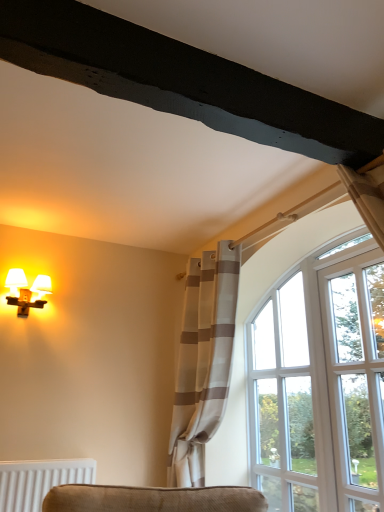
What is the approximate height of matte white sconce at left?

matte white sconce at left is 11.63 inches tall.

Identify the location of clear glass door at right. tap(356, 376).

From the image's perspective, is clear glass door at right over white striped curtain at right?

Yes, from the image's perspective, clear glass door at right is above white striped curtain at right.

Which of these two, clear glass door at right or white striped curtain at right, is bigger?

white striped curtain at right.

Where is `screen door to the right of white striped curtain at right`? The height and width of the screenshot is (512, 384). screen door to the right of white striped curtain at right is located at coordinates (x=356, y=376).

Is the surface of matte white sconce at left in direct contact with clear glass door at right?

They are not placed beside each other.

From a real-world perspective, between matte white sconce at left and clear glass door at right, who is vertically higher?

matte white sconce at left, from a real-world perspective.

Is matte white sconce at left not inside clear glass door at right?

That's correct, matte white sconce at left is outside of clear glass door at right.

Is matte white sconce at left bigger than clear glass door at right?

Incorrect, matte white sconce at left is not larger than clear glass door at right.

From a real-world perspective, is clear glass door at right located higher than matte white sconce at left?

Incorrect, from a real-world perspective, clear glass door at right is lower than matte white sconce at left.

Is clear glass door at right smaller than matte white sconce at left?

No.

Based on the photo, considering the sizes of objects clear glass door at right and matte white sconce at left in the image provided, who is shorter, clear glass door at right or matte white sconce at left?

matte white sconce at left.

Considering the positions of objects clear glass door at right and matte white sconce at left in the image provided, who is behind, clear glass door at right or matte white sconce at left?

matte white sconce at left is further from the camera.

From the image's perspective, does white striped curtain at right appear lower than matte white sconce at left?

Indeed, from the image's perspective, white striped curtain at right is shown beneath matte white sconce at left.

How many degrees apart are the facing directions of white striped curtain at right and matte white sconce at left?

They differ by 90 degrees in their facing directions.

Is white striped curtain at right thinner than matte white sconce at left?

No.

Based on their sizes in the image, would you say white striped curtain at right is bigger or smaller than clear glass door at right?

Clearly, white striped curtain at right is larger in size than clear glass door at right.

Where is `curtain above the clear glass door at right (from a real-world perspective)`? This screenshot has height=512, width=384. curtain above the clear glass door at right (from a real-world perspective) is located at coordinates (203, 362).

How much distance is there between white striped curtain at right and clear glass door at right?

white striped curtain at right and clear glass door at right are 33.06 inches apart from each other.

Which is more to the right, white striped curtain at right or clear glass door at right?

From the viewer's perspective, clear glass door at right appears more on the right side.

Is white striped curtain at right further to camera compared to clear glass window at upper right?

No, white striped curtain at right is closer to the camera.

From the image's perspective, is white striped curtain at right under clear glass window at upper right?

Incorrect, from the image's perspective, white striped curtain at right is higher than clear glass window at upper right.

How different are the orientations of white striped curtain at right and clear glass window at upper right in degrees?

They differ by 0.568 degrees in their facing directions.

How far apart are white striped curtain at right and clear glass window at upper right?

white striped curtain at right is 20.59 inches away from clear glass window at upper right.

Considering the sizes of clear glass window at upper right and clear glass door at right in the image, is clear glass window at upper right taller or shorter than clear glass door at right?

In the image, clear glass window at upper right appears to be taller than clear glass door at right.

Find the location of `window lying behind the clear glass door at right`. window lying behind the clear glass door at right is located at coordinates (289, 398).

Can you tell me how much clear glass window at upper right and clear glass door at right differ in facing direction?

There is a 0.00702-degree angle between the facing directions of clear glass window at upper right and clear glass door at right.

In the scene shown: Does clear glass window at upper right have a smaller size compared to clear glass door at right?

Incorrect, clear glass window at upper right is not smaller in size than clear glass door at right.

Find the location of a particular element. curtain located on the left of clear glass door at right is located at coordinates (203, 362).

Where is `lamp above the clear glass door at right (from the image's perspective)`? lamp above the clear glass door at right (from the image's perspective) is located at coordinates (26, 291).

From the image, which object appears to be nearer to matte white sconce at left, clear glass window at upper right or white striped curtain at right?

Among the two, white striped curtain at right is located nearer to matte white sconce at left.

From the image, which object appears to be farther from white striped curtain at right, matte white sconce at left or clear glass window at upper right?

matte white sconce at left is positioned further to the anchor white striped curtain at right.

Based on their spatial positions, is clear glass door at right or white striped curtain at right closer to clear glass window at upper right?

clear glass door at right lies closer to clear glass window at upper right than the other object.

When comparing their distances from clear glass door at right, does white striped curtain at right or matte white sconce at left seem closer?

The object closer to clear glass door at right is white striped curtain at right.

Looking at the image, which one is located closer to clear glass door at right, white striped curtain at right or clear glass window at upper right?

Among the two, clear glass window at upper right is located nearer to clear glass door at right.

From the image, which object appears to be nearer to matte white sconce at left, white striped curtain at right or clear glass door at right?

Among the two, white striped curtain at right is located nearer to matte white sconce at left.

Based on the photo, from the image, which object appears to be farther from clear glass door at right, clear glass window at upper right or white striped curtain at right?

The object further to clear glass door at right is white striped curtain at right.

Which object lies nearer to the anchor point clear glass window at upper right, white striped curtain at right or clear glass door at right?

The object closer to clear glass window at upper right is clear glass door at right.

This screenshot has width=384, height=512. In order to click on curtain between matte white sconce at left and clear glass door at right from left to right in this screenshot , I will do `click(203, 362)`.

Where is `curtain situated between matte white sconce at left and clear glass window at upper right from left to right`? The height and width of the screenshot is (512, 384). curtain situated between matte white sconce at left and clear glass window at upper right from left to right is located at coordinates (203, 362).

Where is `window between white striped curtain at right and clear glass door at right`? This screenshot has height=512, width=384. window between white striped curtain at right and clear glass door at right is located at coordinates (289, 398).

Where is `window located between matte white sconce at left and clear glass door at right in the left-right direction`? Image resolution: width=384 pixels, height=512 pixels. window located between matte white sconce at left and clear glass door at right in the left-right direction is located at coordinates (289, 398).